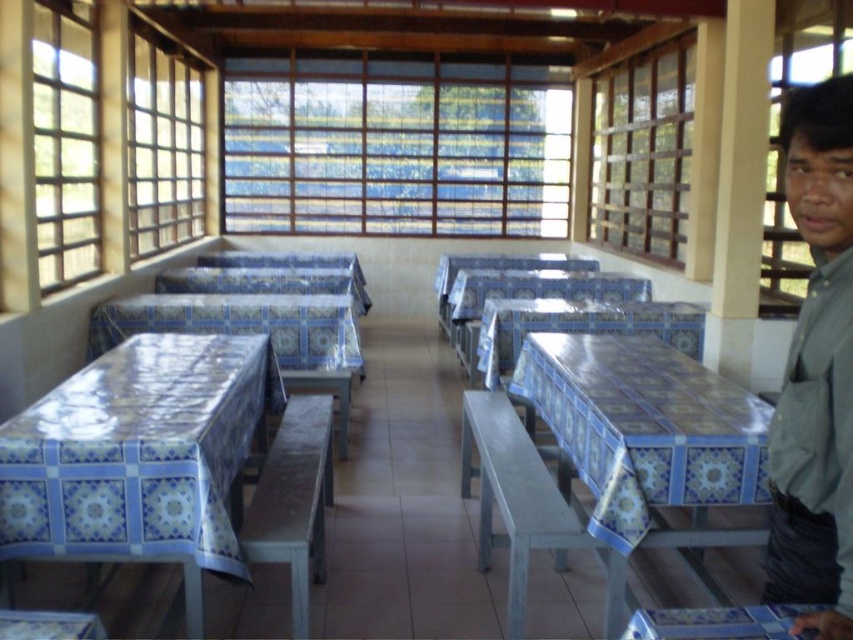
Question: Can you confirm if blue tile table at right is positioned above wooden slats at upper right?

Choices:
 (A) no
 (B) yes

Answer: (A)

Question: Which of the following is the farthest from the observer?

Choices:
 (A) (97, 305)
 (B) (94, 621)
 (C) (119, 429)
 (D) (33, 112)

Answer: (A)

Question: Can you confirm if clear glass window at upper left is positioned to the right of blue tile table at lower center?

Choices:
 (A) yes
 (B) no

Answer: (B)

Question: Which object is closer to the camera taking this photo?

Choices:
 (A) blue/white striped fabric at center
 (B) green matte shirt at right
 (C) wooden slats at upper right

Answer: (B)

Question: Observing the image, what is the correct spatial positioning of blue tile table at center in reference to transparent glass window at upper right?

Choices:
 (A) right
 (B) left

Answer: (B)

Question: Which object is positioned closest to the transparent glass window at upper right?

Choices:
 (A) blue/white striped fabric at center
 (B) blue tile table at right
 (C) blue glossy table at lower left

Answer: (B)